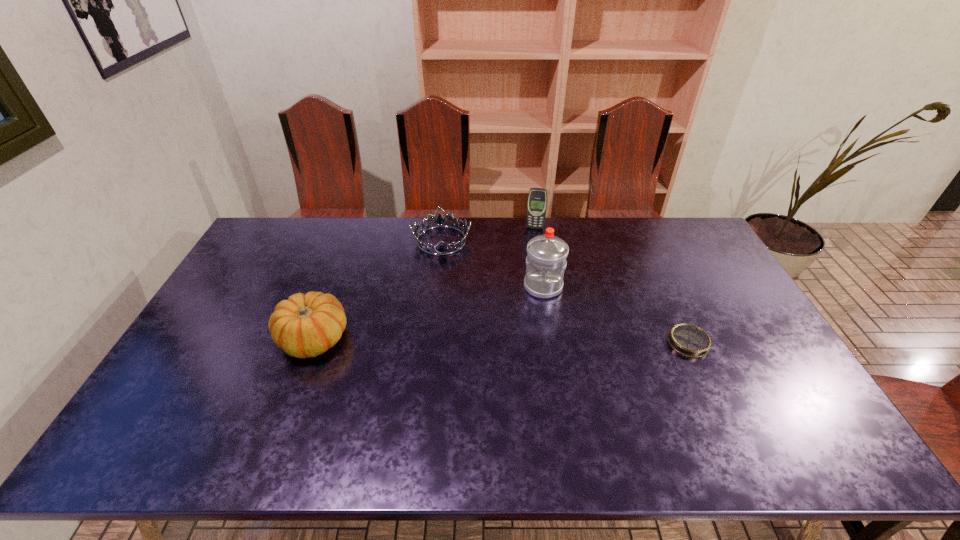
You are a GUI agent. You are given a task and a screenshot of the screen. Output one action in this format:
    pyautogui.click(x=<x>, y=<y>)
    Task: Click on the free spot on the desktop that is between the gourd and the shortest object and is positioned on the screen of the cellular telephone
    This screenshot has width=960, height=540.
    Given the screenshot: What is the action you would take?
    pyautogui.click(x=518, y=341)

At what (x,y) coordinates should I click in order to perform the action: click on vacant space on the desktop that is between the gourd and the rightmost object and is positioned on the handle side of the tallest object. Please return your answer as a coordinate pair (x, y). The height and width of the screenshot is (540, 960). Looking at the image, I should click on (537, 341).

This screenshot has width=960, height=540. What are the coordinates of `free space on the desktop that is between the leftmost object and the rightmost object and is positioned on the front-facing side of the second shortest object` in the screenshot? It's located at (447, 340).